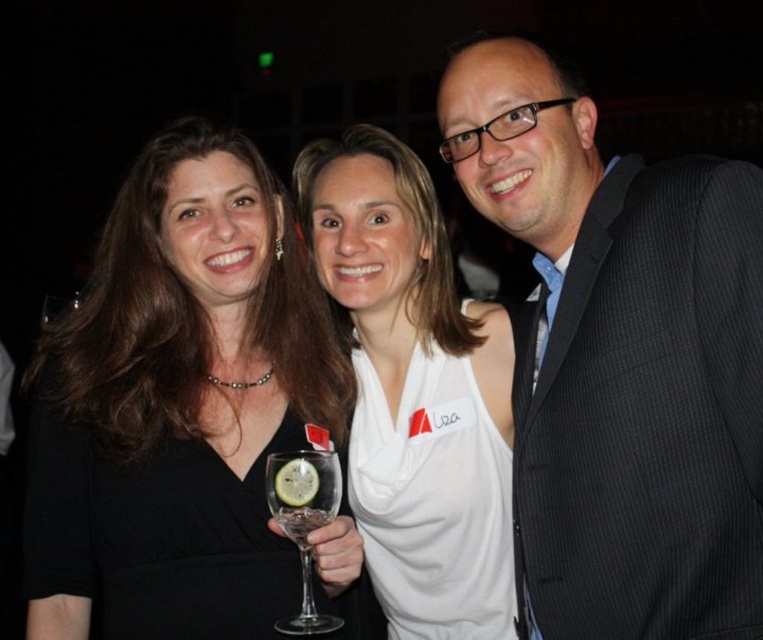
Question: Among these objects, which one is nearest to the camera?

Choices:
 (A) clear glass wine glass at center
 (B) white jersey at center
 (C) black matte dress at center
 (D) dark gray pinstripe suit at center

Answer: (D)

Question: Is dark gray pinstripe suit at center to the left of white matte tank top at center from the viewer's perspective?

Choices:
 (A) yes
 (B) no

Answer: (B)

Question: Among these points, which one is farthest from the camera?

Choices:
 (A) (446, 365)
 (B) (219, 506)
 (C) (353, 176)

Answer: (C)

Question: Can you confirm if white matte tank top at center is positioned below clear glass wine glass at center?

Choices:
 (A) yes
 (B) no

Answer: (B)

Question: Which of the following is the farthest from the observer?

Choices:
 (A) (422, 445)
 (B) (349, 424)

Answer: (B)

Question: Does white matte tank top at center appear on the left side of white jersey at center?

Choices:
 (A) no
 (B) yes

Answer: (B)